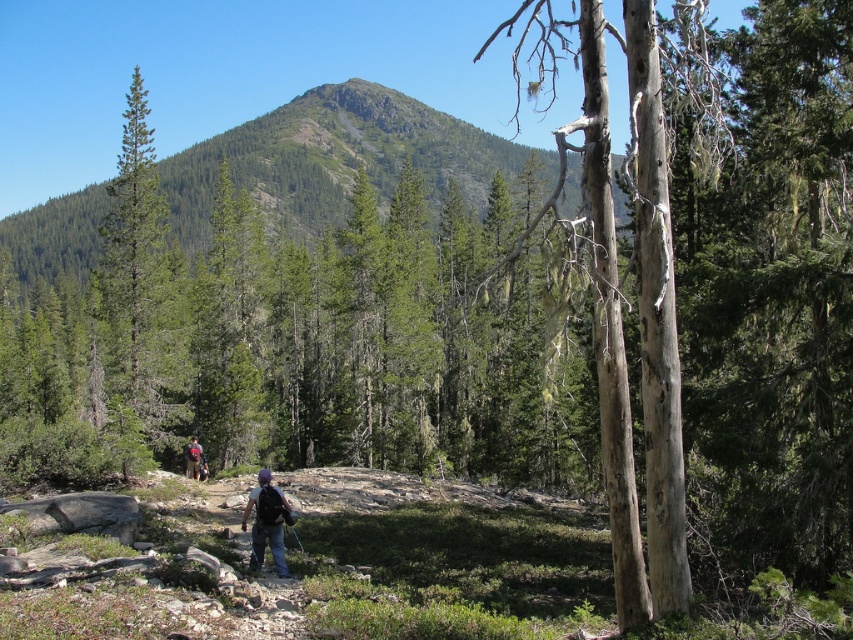
Question: In this image, where is dark blue jeans at center located relative to matte gray backpack at center?

Choices:
 (A) left
 (B) right

Answer: (B)

Question: Does green matte tree at left lie in front of matte gray backpack at center?

Choices:
 (A) yes
 (B) no

Answer: (A)

Question: Which point is farther to the camera?

Choices:
 (A) (105, 340)
 (B) (254, 554)

Answer: (A)

Question: Which of the following is the farthest from the observer?

Choices:
 (A) green matte tree at left
 (B) dark blue jeans at center
 (C) matte gray backpack at center

Answer: (C)

Question: Estimate the real-world distances between objects in this image. Which object is farther from the dark blue jeans at center?

Choices:
 (A) matte gray backpack at center
 (B) green matte tree at left

Answer: (B)

Question: Is dark blue jeans at center to the right of matte gray backpack at center from the viewer's perspective?

Choices:
 (A) no
 (B) yes

Answer: (B)